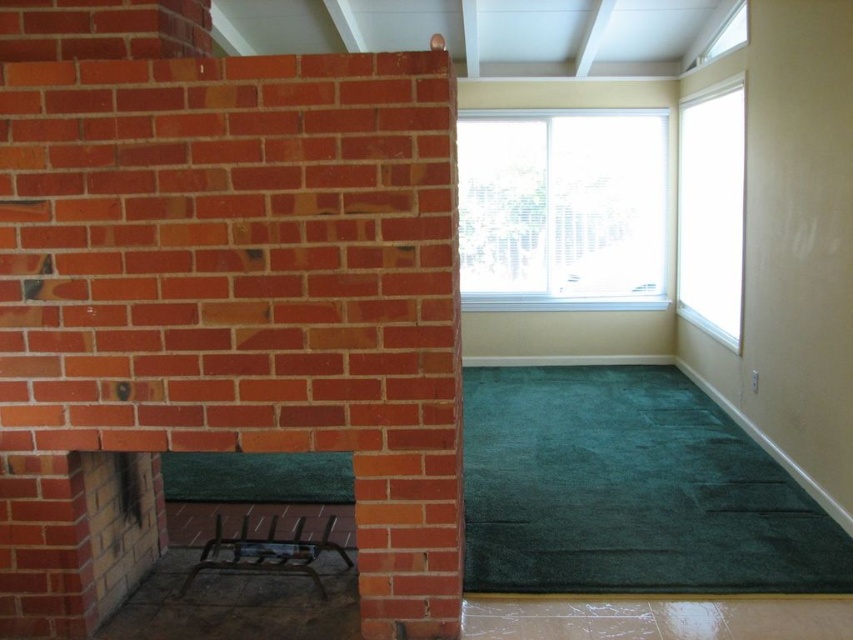
Question: Considering the relative positions of clear glass window at upper center and transparent glass window at upper right in the image provided, where is clear glass window at upper center located with respect to transparent glass window at upper right?

Choices:
 (A) above
 (B) below

Answer: (A)

Question: Which point appears closest to the camera in this image?

Choices:
 (A) (479, 145)
 (B) (735, 129)

Answer: (B)

Question: Based on their relative distances, which object is nearer to the clear glass window at upper center?

Choices:
 (A) metallic grate at lower left
 (B) transparent glass window at upper right

Answer: (B)

Question: Is metallic grate at lower left bigger than transparent glass window at upper right?

Choices:
 (A) yes
 (B) no

Answer: (A)

Question: Is clear glass window at upper center to the right of transparent glass window at upper right from the viewer's perspective?

Choices:
 (A) yes
 (B) no

Answer: (B)

Question: Estimate the real-world distances between objects in this image. Which object is farther from the clear glass window at upper center?

Choices:
 (A) transparent glass window at upper right
 (B) metallic grate at lower left

Answer: (B)